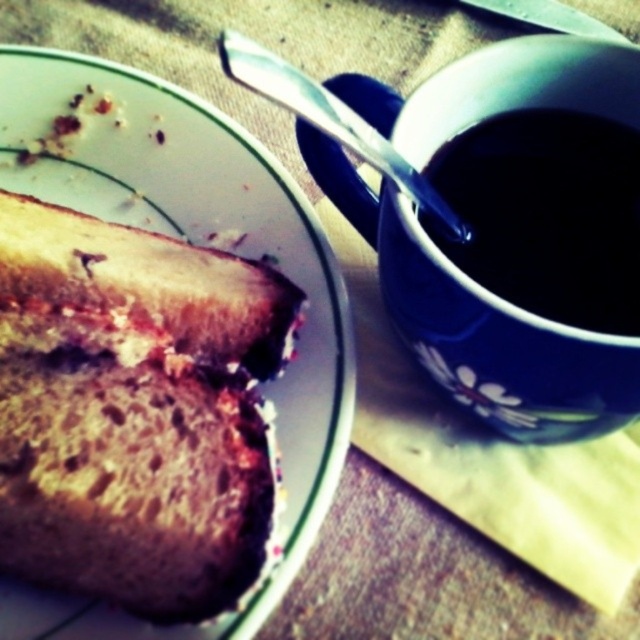
Question: Which is farther from the silver metallic fork at upper center?

Choices:
 (A) blue glossy mug at upper right
 (B) white glossy plate at upper left

Answer: (B)

Question: Does blue glossy mug at upper right appear over dark matte cup at upper right?

Choices:
 (A) no
 (B) yes

Answer: (A)

Question: Is blue glossy mug at upper right below silver metallic fork at upper center?

Choices:
 (A) no
 (B) yes

Answer: (B)

Question: Among these objects, which one is farthest from the camera?

Choices:
 (A) silver metallic fork at upper center
 (B) dark matte cup at upper right
 (C) blue glossy mug at upper right

Answer: (B)

Question: Which point is farther to the camera?

Choices:
 (A) blue glossy mug at upper right
 (B) dark matte cup at upper right
 (C) brown crumbly bread at center
 (D) silver metallic fork at upper center

Answer: (C)

Question: Does white glossy plate at upper left have a greater width compared to brown crumbly bread at center?

Choices:
 (A) yes
 (B) no

Answer: (A)